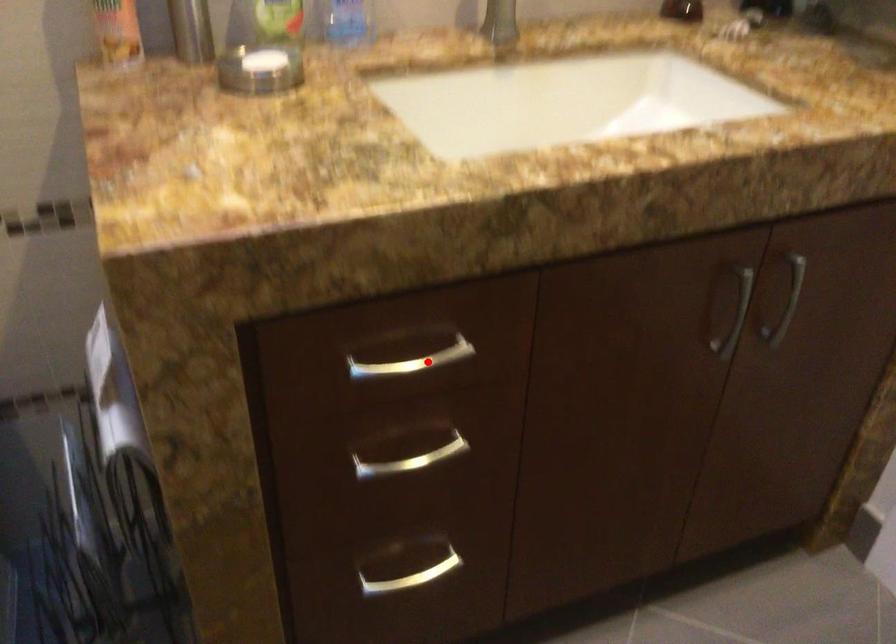
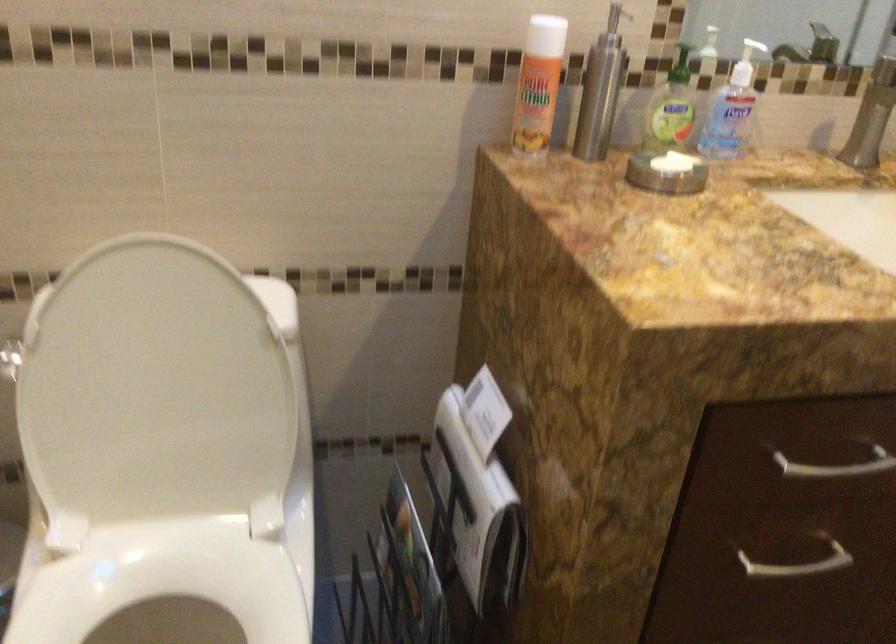
In the second image, find the point that corresponds to the highlighted location in the first image.

(837, 466)